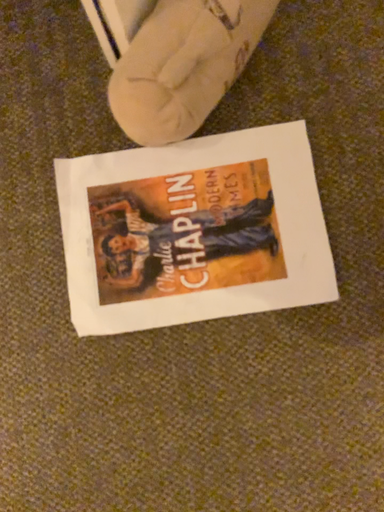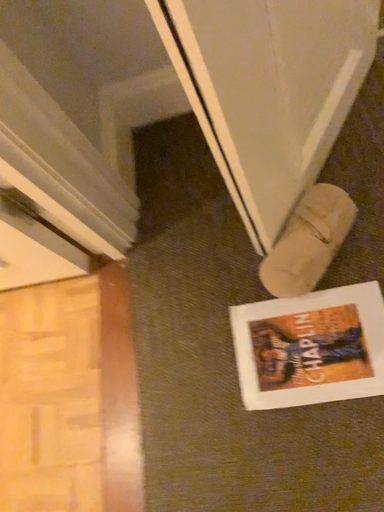
Question: Which way did the camera rotate in the video?

Choices:
 (A) rotated right
 (B) rotated left

Answer: (B)